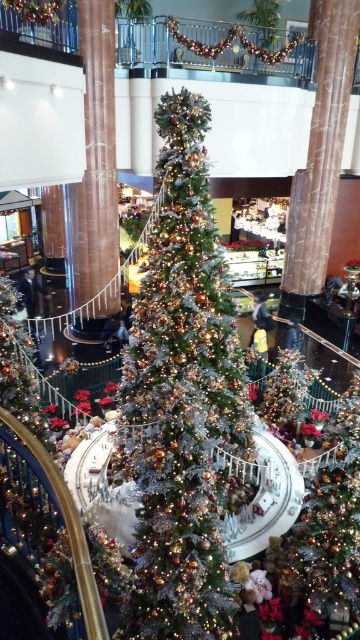
Question: Does shiny silver christmas tree at center appear on the right side of brown marble pillar at center?

Choices:
 (A) yes
 (B) no

Answer: (A)

Question: Among these points, which one is nearest to the camera?

Choices:
 (A) (105, 112)
 (B) (204, 208)

Answer: (B)

Question: Which point is farther to the camera?

Choices:
 (A) shiny silver christmas tree at center
 (B) brown marble pillar at center

Answer: (B)

Question: Does shiny silver christmas tree at center have a greater width compared to brown marble pillar at center?

Choices:
 (A) yes
 (B) no

Answer: (A)

Question: Can you confirm if shiny silver christmas tree at center is positioned below brown marble pillar at center?

Choices:
 (A) no
 (B) yes

Answer: (B)